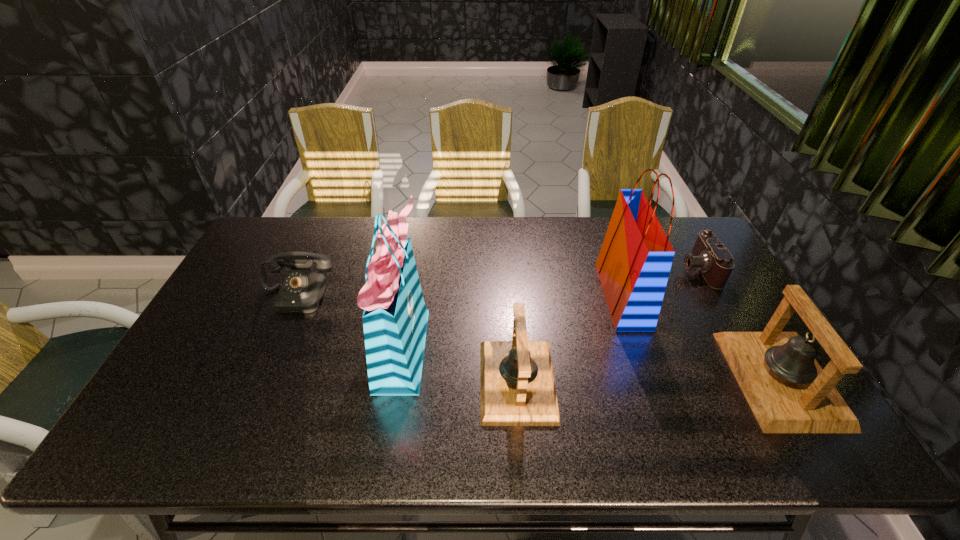
What are the coordinates of `empty space between the telephone and the second object from left to right` in the screenshot? It's located at (349, 321).

Identify which object is the fifth closest to the fourth object from left to right. Please provide its 2D coordinates. Your answer should be formatted as a tuple, i.e. [(x, y)], where the tuple contains the x and y coordinates of a point satisfying the conditions above.

[(301, 292)]

The height and width of the screenshot is (540, 960). In order to click on object that can be found as the third closest to the shortest object in this screenshot , I will do `click(517, 383)`.

The height and width of the screenshot is (540, 960). What are the coordinates of `vacant point that satisfies the following two spatial constraints: 1. on the front-facing side of the camera; 2. on the front side of the fourth tallest object` in the screenshot? It's located at (761, 381).

Identify the location of vacant point that satisfies the following two spatial constraints: 1. on the dial of the leftmost object; 2. on the left side of the third tallest object. pos(261,379).

Image resolution: width=960 pixels, height=540 pixels. I want to click on vacant space that satisfies the following two spatial constraints: 1. on the front side of the fifth object from right to left; 2. on the right side of the fourth shortest object, so click(397, 379).

The image size is (960, 540). In order to click on free spot that satisfies the following two spatial constraints: 1. on the handle side of the right shopping bag; 2. on the front side of the shorter bell in this screenshot , I will do `click(652, 381)`.

Locate an element on the screen. This screenshot has height=540, width=960. vacant space that satisfies the following two spatial constraints: 1. on the back side of the right bell; 2. on the handle side of the right shopping bag is located at coordinates (731, 296).